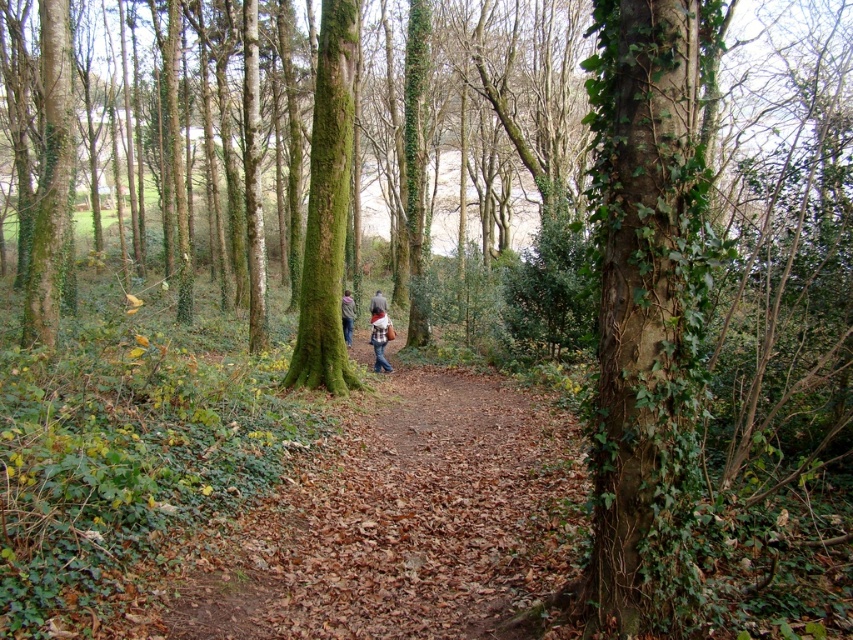
You are a hiker who wants to choose a jacket to stay warm in the forest. You have two options at the center of the path, the denim jacket at center and the brown leather jacket at center. Which jacket is taller and might provide better coverage?

The denim jacket at center is much taller than the brown leather jacket at center, so it might provide better coverage.

You are a hiker who has lost your way in the forest. You see a green mossy tree at center and a denim jacket at center. Which object is closer to the left side of your path?

The green mossy tree at center is to the left of the denim jacket at center, so it is closer to the left side of your path.